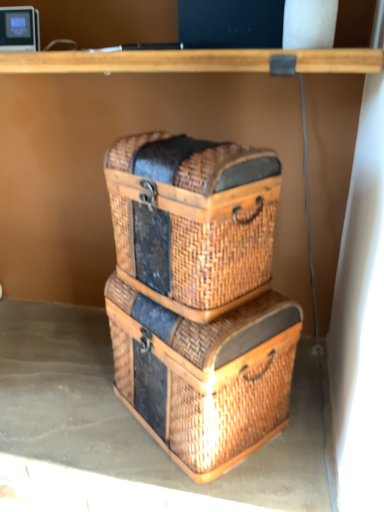
Image resolution: width=384 pixels, height=512 pixels. I want to click on woven brown basket at center, so click(x=193, y=220).

In order to face woven brown crate at center, should I rotate leftwards or rightwards?

A 0.895 degree turn to the right will do.

Where is `woven brown basket at center`? This screenshot has height=512, width=384. woven brown basket at center is located at coordinates (193, 220).

Is woven brown basket at center further to camera compared to woven brown basket at center?

No, it is not.

Looking at this image, from the image's perspective, is woven brown basket at center positioned above or below woven brown basket at center?

Clearly, from the image's perspective, woven brown basket at center is above woven brown basket at center.

Does woven brown basket at center have a smaller size compared to woven brown basket at center?

No.

Which of these two, woven brown basket at center or woven brown basket at center, is wider?

woven brown basket at center is wider.

Is woven brown crate at center a part of woven brown basket at center?

No, woven brown crate at center is not a part of woven brown basket at center.

Considering the sizes of objects woven brown basket at center and woven brown crate at center in the image provided, who is taller, woven brown basket at center or woven brown crate at center?

woven brown crate at center.

Is point (40, 396) farther from viewer compared to point (251, 324)?

Yes, it is behind point (251, 324).

Is the surface of woven brown basket at center in direct contact with woven brown crate at center?

woven brown basket at center and woven brown crate at center are clearly separated.

Which point is more forward, (275, 354) or (305, 359)?

Point (275, 354)

Which of these two, woven brown crate at center or woven brown basket at center, stands shorter?

woven brown basket at center.

Relative to woven brown basket at center, is woven brown crate at center in front or behind?

woven brown crate at center is positioned closer to the viewer than woven brown basket at center.

Identify the location of crate located below the woven brown basket at center (from the image's perspective). (204, 375).

From a real-world perspective, who is located higher, woven brown crate at center or woven brown basket at center?

In real-world perspective, woven brown basket at center is above.

Does woven brown crate at center appear on the right side of woven brown basket at center?

Correct, you'll find woven brown crate at center to the right of woven brown basket at center.

Considering the relative sizes of woven brown basket at center and woven brown crate at center in the image provided, is woven brown basket at center wider than woven brown crate at center?

No, woven brown basket at center is not wider than woven brown crate at center.

Is woven brown basket at center turned away from woven brown crate at center?

No, woven brown crate at center is not at the back of woven brown basket at center.

Looking at the image, does woven brown basket at center seem bigger or smaller compared to woven brown crate at center?

woven brown basket at center is smaller than woven brown crate at center.

Can you confirm if woven brown basket at center is positioned to the left of woven brown crate at center?

Indeed, woven brown basket at center is positioned on the left side of woven brown crate at center.

Does woven brown basket at center have a smaller size compared to woven brown basket at center?

Yes.

From the image's perspective, is woven brown basket at center beneath woven brown basket at center?

Yes, from the image's perspective, woven brown basket at center is below woven brown basket at center.

Is the position of woven brown basket at center more distant than that of woven brown basket at center?

Yes, woven brown basket at center is further from the camera.

Where is `concrete located on the left of woven brown basket at center`? The width and height of the screenshot is (384, 512). concrete located on the left of woven brown basket at center is located at coordinates (129, 428).

At what (x,y) coordinates should I click in order to perform the action: click on crate that is in front of the woven brown basket at center. Please return your answer as a coordinate pair (x, y). The width and height of the screenshot is (384, 512). Looking at the image, I should click on (204, 375).

From the image, which object appears to be nearer to woven brown basket at center, woven brown crate at center or woven brown basket at center?

woven brown crate at center lies closer to woven brown basket at center than the other object.

From the image, which object appears to be nearer to woven brown basket at center, woven brown basket at center or woven brown crate at center?

woven brown crate at center lies closer to woven brown basket at center than the other object.

Consider the image. Estimate the real-world distances between objects in this image. Which object is closer to woven brown crate at center, woven brown basket at center or woven brown basket at center?

woven brown basket at center lies closer to woven brown crate at center than the other object.

Estimate the real-world distances between objects in this image. Which object is closer to woven brown crate at center, woven brown basket at center or woven brown basket at center?

woven brown basket at center.

From the picture: When comparing their distances from woven brown basket at center, does woven brown crate at center or woven brown basket at center seem closer?

woven brown crate at center is positioned closer to the anchor woven brown basket at center.

Estimate the real-world distances between objects in this image. Which object is closer to woven brown basket at center, woven brown basket at center or woven brown crate at center?

The object closer to woven brown basket at center is woven brown crate at center.

The height and width of the screenshot is (512, 384). Identify the location of crate between woven brown basket at center and woven brown basket at center in the up-down direction. (204, 375).